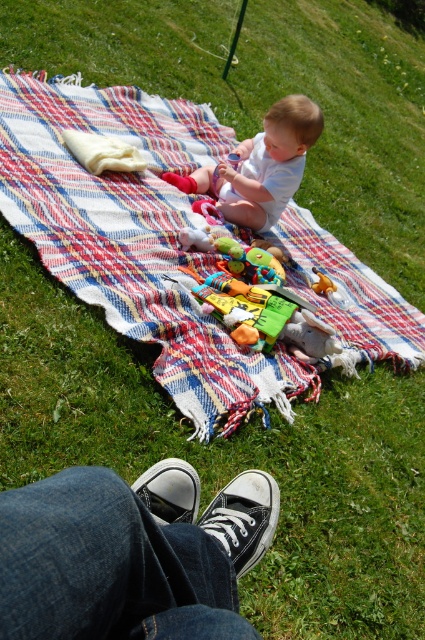
Is the position of white canvas shoes at lower center less distant than that of rubberized plastic toy at center?

Yes, it is.

Between white canvas shoes at lower center and rubberized plastic toy at center, which one appears on the right side from the viewer's perspective?

From the viewer's perspective, white canvas shoes at lower center appears more on the right side.

Is point (178, 506) farther from viewer compared to point (195, 228)?

No, it is in front of (195, 228).

Image resolution: width=425 pixels, height=640 pixels. I want to click on white canvas shoes at lower center, so click(x=130, y=554).

Who is more forward, (258, 141) or (198, 234)?

Positioned in front is point (198, 234).

Between point (277, 192) and point (186, 236), which one is positioned behind?

Point (277, 192)

Is point (215, 172) positioned after point (203, 227)?

Yes, it is behind point (203, 227).

At what (x,y) coordinates should I click in order to perform the action: click on smooth white baby at center. Please return your answer as a coordinate pair (x, y). The image size is (425, 640). Looking at the image, I should click on (260, 164).

Does smooth white baby at center have a lesser width compared to rubber duck at center?

No, smooth white baby at center is not thinner than rubber duck at center.

The width and height of the screenshot is (425, 640). Identify the location of smooth white baby at center. (260, 164).

Between point (201, 186) and point (325, 288), which one is positioned in front?

Point (325, 288)

Find the location of `smooth white baby at center`. smooth white baby at center is located at coordinates (260, 164).